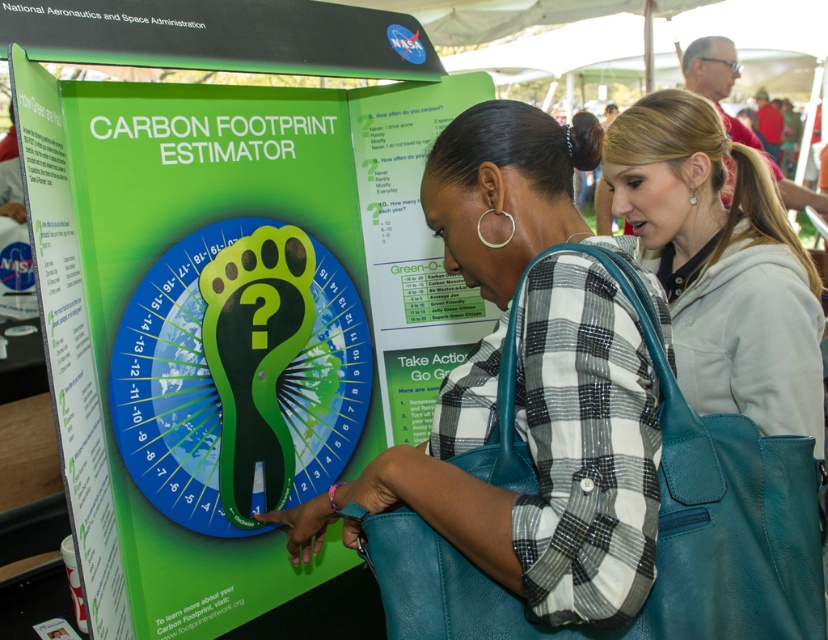
Question: Is teal leather handbag at center behind light gray hoodie at center?

Choices:
 (A) yes
 (B) no

Answer: (B)

Question: Can you confirm if teal leather handbag at center is bigger than light gray hoodie at center?

Choices:
 (A) no
 (B) yes

Answer: (B)

Question: Which of the following is the closest to the observer?

Choices:
 (A) (653, 529)
 (B) (244, 502)
 (C) (774, 406)

Answer: (A)

Question: Which point appears farthest from the camera in this image?

Choices:
 (A) (467, 188)
 (B) (679, 147)
 (C) (326, 218)

Answer: (B)

Question: Is green plastic carbon footprint estimator at center positioned in front of light gray hoodie at center?

Choices:
 (A) no
 (B) yes

Answer: (B)

Question: Which point appears closest to the camera in this image?

Choices:
 (A) pos(656,212)
 (B) pos(181,104)
 (C) pos(446,272)

Answer: (C)